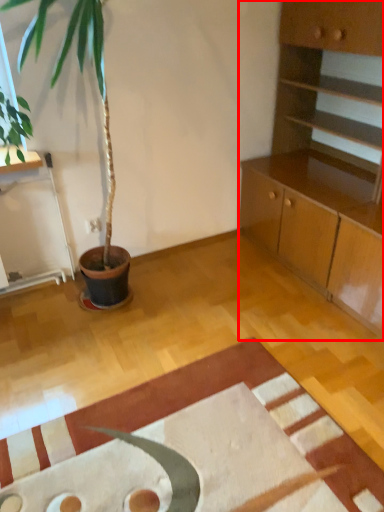
Question: From the image's perspective, where is cabinetry (annotated by the red box) located relative to mat?

Choices:
 (A) above
 (B) below

Answer: (A)